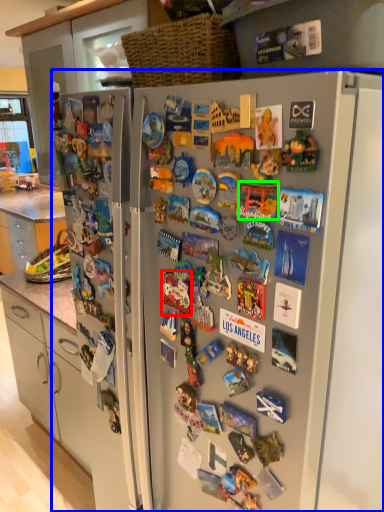
Question: Estimate the real-world distances between objects in this image. Which object is farther from toy (highlighted by a red box), refrigerator (highlighted by a blue box) or toy (highlighted by a green box)?

Choices:
 (A) refrigerator
 (B) toy

Answer: (A)